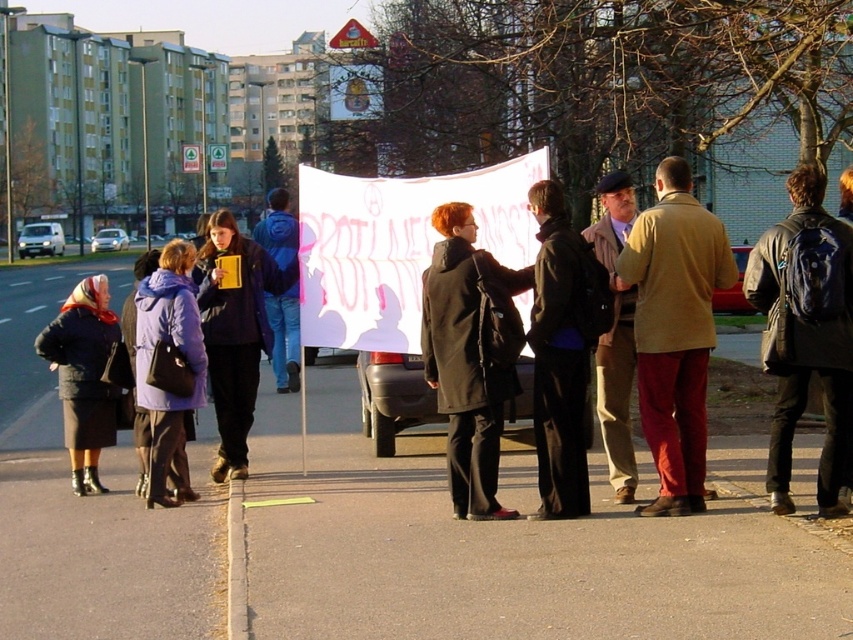
You are a photographer trying to capture a clear shot of the dark green coat at center and the dark blue wool coat at left. Since you want both coats to be visible in the photo, which coat should you focus on first to ensure both are in frame?

The dark green coat at center is positioned over the dark blue wool coat at left, so you should focus on the dark blue wool coat at left first to ensure both are visible in the photo.

You are a photographer standing at the edge of the protest scene. You want to take a photo of the matte black coat at center and the brushed metal mug at center. If your camera has a depth of field that can focus on objects within a 10 feet range, will both items be in focus?

The matte black coat at center is 9.29 feet away from the brushed metal mug at center. Since the distance between them is within the 10 feet range, both items will be in focus.